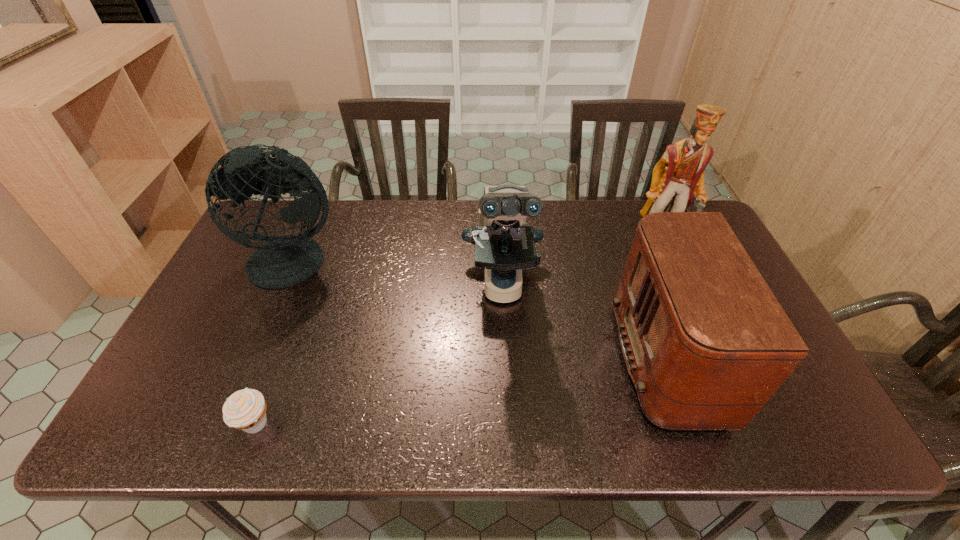
The width and height of the screenshot is (960, 540). I want to click on free spot between the microscope and the second shortest object, so click(x=594, y=321).

Locate an element on the screen. The height and width of the screenshot is (540, 960). vacant point located between the muffin and the nutcracker is located at coordinates (459, 334).

Locate an element on the screen. Image resolution: width=960 pixels, height=540 pixels. unoccupied position between the muffin and the globe is located at coordinates (276, 343).

Where is `free point between the globe and the muffin`? The height and width of the screenshot is (540, 960). free point between the globe and the muffin is located at coordinates (276, 343).

In order to click on vacant area between the microscope and the globe in this screenshot , I will do `click(399, 273)`.

The height and width of the screenshot is (540, 960). I want to click on vacant region between the microscope and the muffin, so click(x=379, y=354).

Select which object appears as the closest to the muffin. Please provide its 2D coordinates. Your answer should be formatted as a tuple, i.e. [(x, y)], where the tuple contains the x and y coordinates of a point satisfying the conditions above.

[(284, 261)]

The image size is (960, 540). In order to click on object that can be found as the second closest to the radio receiver in this screenshot , I will do `click(678, 177)`.

Where is `vacant space that satisfies the following two spatial constraints: 1. on the front-facing side of the nutcracker; 2. on the front panel of the radio receiver`? vacant space that satisfies the following two spatial constraints: 1. on the front-facing side of the nutcracker; 2. on the front panel of the radio receiver is located at coordinates (714, 360).

The image size is (960, 540). Find the location of `blank area in the image that satisfies the following two spatial constraints: 1. on the front panel of the radio receiver; 2. on the front side of the shortest object`. blank area in the image that satisfies the following two spatial constraints: 1. on the front panel of the radio receiver; 2. on the front side of the shortest object is located at coordinates (712, 424).